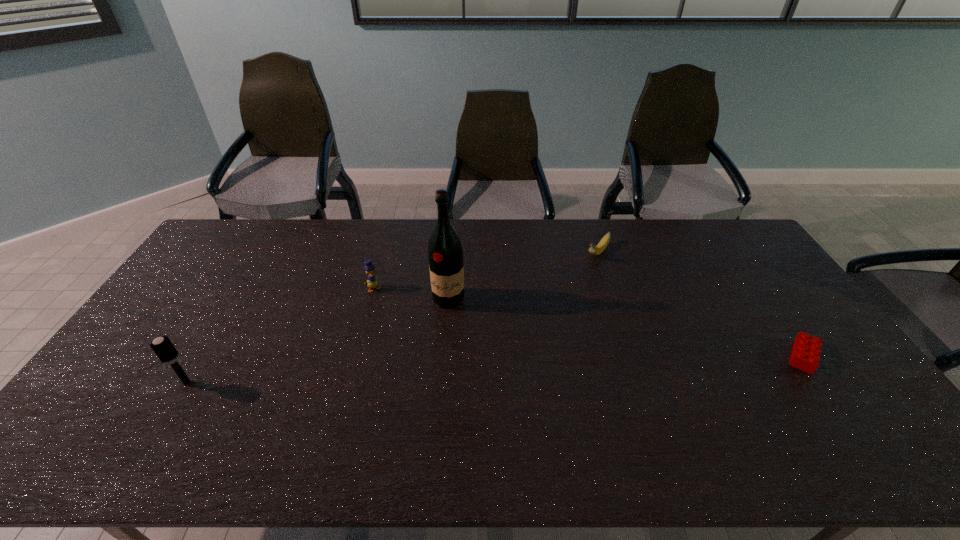
Image resolution: width=960 pixels, height=540 pixels. I want to click on the nearest object, so click(164, 349).

You are a GUI agent. You are given a task and a screenshot of the screen. Output one action in this format:
    pyautogui.click(x=<x>, y=<y>)
    Task: Click on the hairbrush
    The height and width of the screenshot is (540, 960).
    Given the screenshot: What is the action you would take?
    pyautogui.click(x=164, y=349)

Locate an element on the screen. the rightmost object is located at coordinates (806, 351).

I want to click on Lego, so click(806, 351).

Find the location of a particular element. This screenshot has width=960, height=540. the third shortest object is located at coordinates (372, 282).

You are a GUI agent. You are given a task and a screenshot of the screen. Output one action in this format:
    pyautogui.click(x=<x>, y=<y>)
    Task: Click on the second object from left to right
    This screenshot has height=540, width=960.
    Given the screenshot: What is the action you would take?
    pyautogui.click(x=372, y=282)

This screenshot has height=540, width=960. Identify the location of the tallest object. (445, 254).

Where is `the third object from left to right`? Image resolution: width=960 pixels, height=540 pixels. the third object from left to right is located at coordinates (445, 254).

The width and height of the screenshot is (960, 540). I want to click on banana, so click(x=595, y=250).

Locate an element on the screen. The height and width of the screenshot is (540, 960). the farthest object is located at coordinates (595, 250).